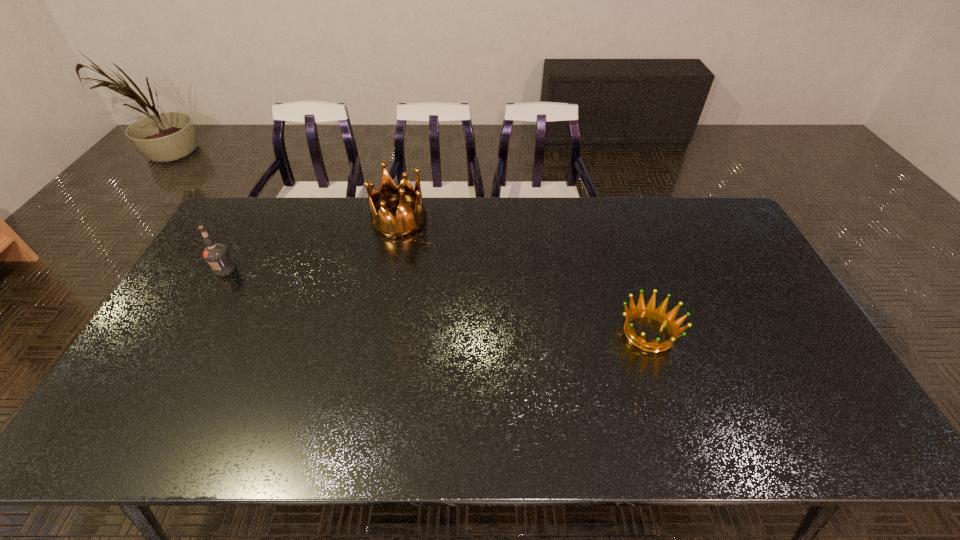
The image size is (960, 540). Identify the location of vacant area that lies between the left crown and the second nearest object. (312, 245).

Find the location of a particular element. This screenshot has width=960, height=540. vacant area that lies between the vodka and the farthest object is located at coordinates (312, 245).

At what (x,y) coordinates should I click in order to perform the action: click on vacant region between the second farthest object and the nearer crown. Please return your answer as a coordinate pair (x, y). Looking at the image, I should click on (437, 301).

Locate an element on the screen. The height and width of the screenshot is (540, 960). free point between the second object from left to right and the vodka is located at coordinates pos(312,245).

At what (x,y) coordinates should I click in order to perform the action: click on unoccupied position between the second farthest object and the nearest object. Please return your answer as a coordinate pair (x, y). Looking at the image, I should click on (437, 301).

Identify which object is the second closest to the nearest object. Please provide its 2D coordinates. Your answer should be formatted as a tuple, i.e. [(x, y)], where the tuple contains the x and y coordinates of a point satisfying the conditions above.

[(217, 256)]

Where is `object identified as the second closest to the left crown`? object identified as the second closest to the left crown is located at coordinates (x=659, y=314).

I want to click on free space in the image that satisfies the following two spatial constraints: 1. on the front label of the right crown; 2. on the left side of the second farthest object, so click(189, 333).

I want to click on vacant region that satisfies the following two spatial constraints: 1. on the front label of the shortest object; 2. on the left side of the leftmost object, so click(x=189, y=333).

Where is `vacant region that satisfies the following two spatial constraints: 1. on the front label of the rightmost object; 2. on the left side of the vodka`? The image size is (960, 540). vacant region that satisfies the following two spatial constraints: 1. on the front label of the rightmost object; 2. on the left side of the vodka is located at coordinates (189, 333).